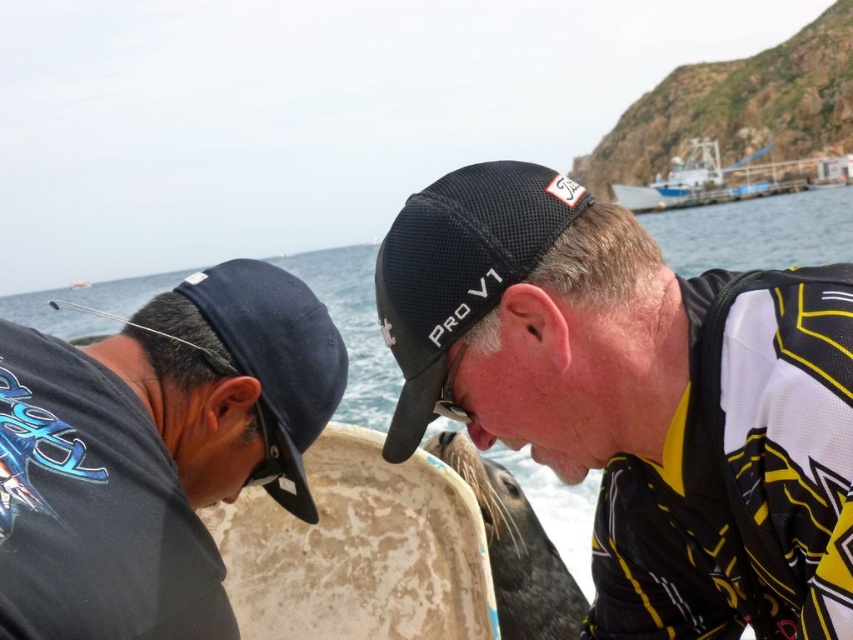
Question: Which point is closer to the camera?

Choices:
 (A) (619, 506)
 (B) (223, 340)
 (C) (825, 205)

Answer: (B)

Question: Considering the relative positions of navy blue fabric baseball cap at left and blue matte boat at upper right in the image provided, where is navy blue fabric baseball cap at left located with respect to blue matte boat at upper right?

Choices:
 (A) left
 (B) right

Answer: (A)

Question: Does black matte baseball cap at left lie behind yellow/black mesh wetsuit at center?

Choices:
 (A) no
 (B) yes

Answer: (A)

Question: Which point is farther to the camera?

Choices:
 (A) (842, 435)
 (B) (480, 291)
 (C) (756, 536)
 (D) (196, 323)

Answer: (D)

Question: In this image, where is black mesh cap at upper center located relative to black mesh cap at center?

Choices:
 (A) above
 (B) below

Answer: (B)

Question: Among these objects, which one is farthest from the camera?

Choices:
 (A) clear blue water at center
 (B) black mesh cap at upper center
 (C) blue matte boat at upper right
 (D) black matte baseball cap at left

Answer: (C)